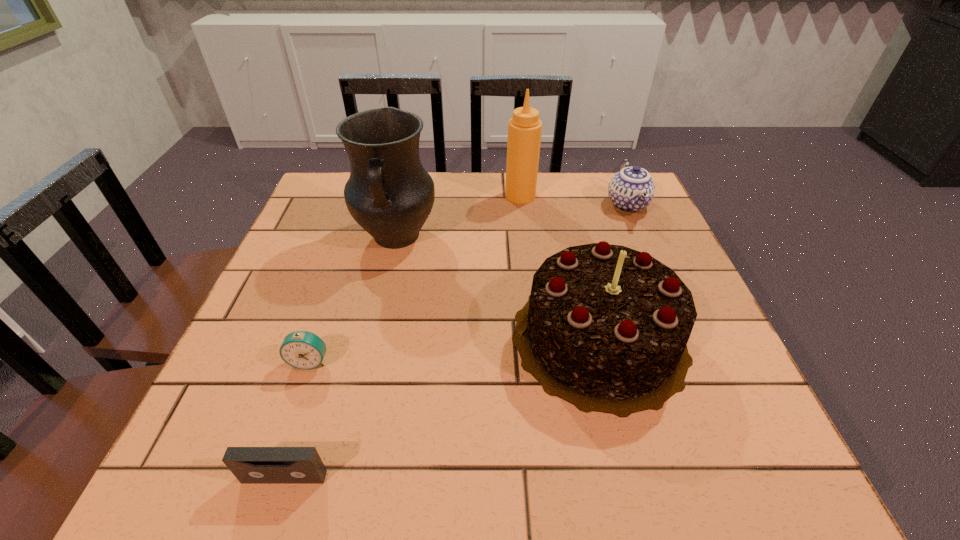
Where is `free space located on the front-facing side of the alarm clock`? The height and width of the screenshot is (540, 960). free space located on the front-facing side of the alarm clock is located at coordinates (291, 416).

Locate an element on the screen. The height and width of the screenshot is (540, 960). condiment that is at the far edge is located at coordinates (525, 128).

At what (x,y) coordinates should I click in order to perform the action: click on pitcher that is positioned at the far edge. Please return your answer as a coordinate pair (x, y). The height and width of the screenshot is (540, 960). Looking at the image, I should click on (389, 194).

Identify the location of chinaware at the far edge. This screenshot has height=540, width=960. click(631, 189).

Locate an element on the screen. object at the near edge is located at coordinates (250, 465).

Locate an element on the screen. pitcher positioned at the left edge is located at coordinates (389, 194).

Where is `alarm clock located at the left edge`? The height and width of the screenshot is (540, 960). alarm clock located at the left edge is located at coordinates (304, 350).

At what (x,y) coordinates should I click in order to perform the action: click on videotape present at the left edge. Please return your answer as a coordinate pair (x, y). This screenshot has height=540, width=960. Looking at the image, I should click on (250, 465).

You are a GUI agent. You are given a task and a screenshot of the screen. Output one action in this format:
    pyautogui.click(x=<x>, y=<y>)
    Task: Click on the birthday cake located at the right edge
    The image size is (960, 540).
    Given the screenshot: What is the action you would take?
    pyautogui.click(x=605, y=328)

At what (x,y) coordinates should I click in order to perform the action: click on chinaware located in the right edge section of the desktop. Please return your answer as a coordinate pair (x, y). This screenshot has width=960, height=540. Looking at the image, I should click on (631, 189).